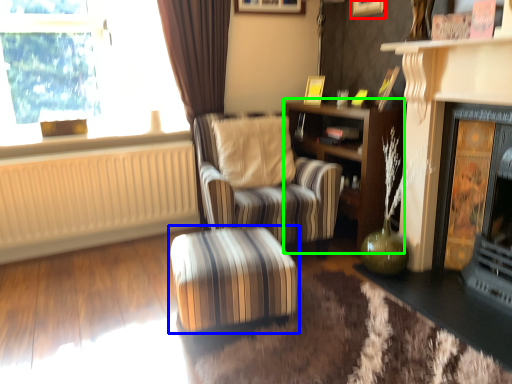
Question: Considering the real-world distances, which object is closest to picture frame (highlighted by a red box)? table (highlighted by a blue box) or shelf (highlighted by a green box).

Choices:
 (A) table
 (B) shelf

Answer: (B)